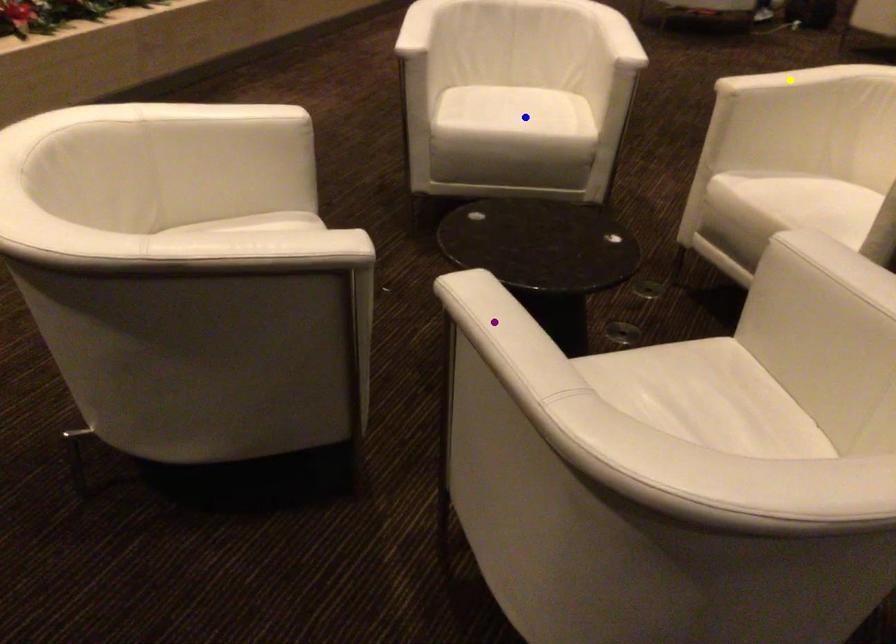
Order these from nearest to farthest:
blue point
purple point
yellow point

1. purple point
2. yellow point
3. blue point